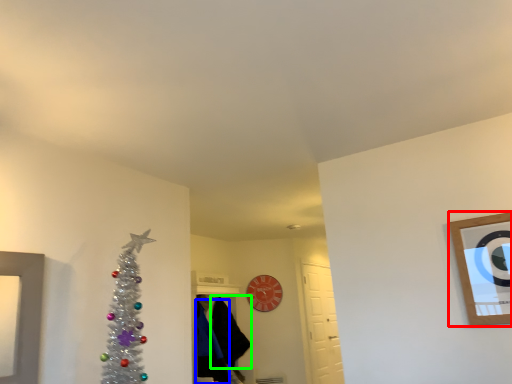
Question: Based on their relative distances, which object is farther from picture frame (highlighted by a red box)? Choose from robe (highlighted by a blue box) and robe (highlighted by a green box).

Choices:
 (A) robe
 (B) robe

Answer: (A)